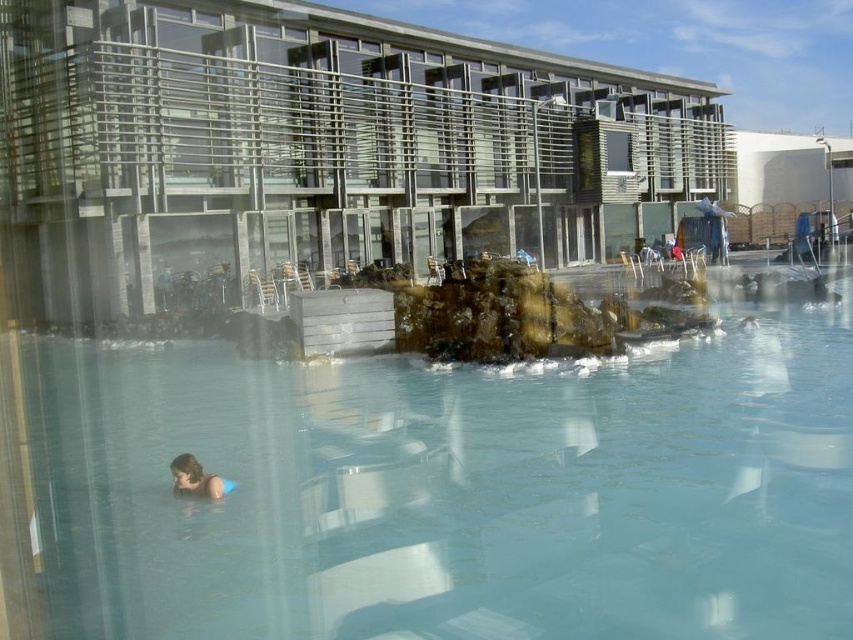
You are standing at the edge of the pool and want to see the smooth skin person at lower left. Can you see them through the clear glass water at center?

Yes, the clear glass water at center is in front of the smooth skin person at lower left, so you can see the smooth skin person at lower left through the clear glass water at center since it is transparent.